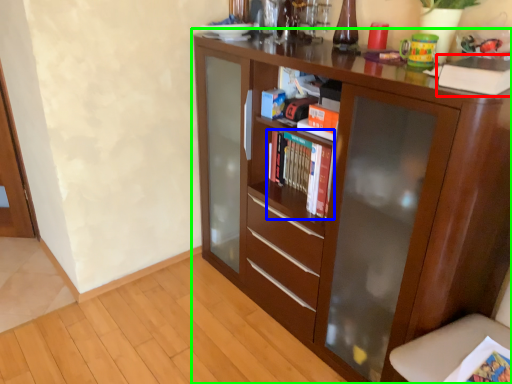
Question: Which is nearer to the paperback book (highlighted by a red box)? book (highlighted by a blue box) or cupboard (highlighted by a green box).

Choices:
 (A) book
 (B) cupboard

Answer: (A)